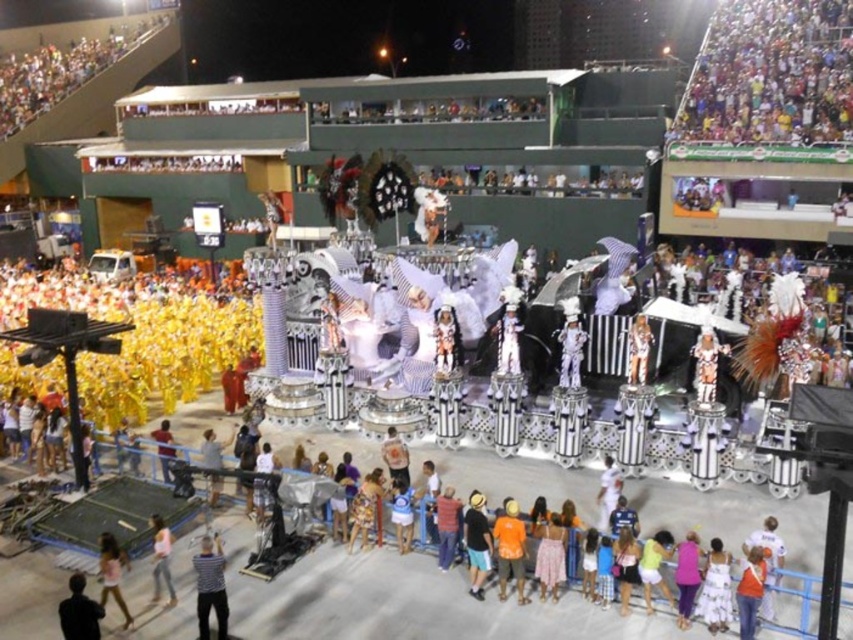
You are a photographer at the carnival parade. You want to take a photo of the orange cotton shirt at center and the black cotton shirt at center so that both shirts are fully visible. Which shirt should you focus on to ensure the shorter one is not cut off?

The orange cotton shirt at center is shorter than the black cotton shirt at center. To ensure the shorter one is not cut off, focus on framing the photo around the black cotton shirt at center since it is taller and requires more vertical space.

You are a photographer standing at the center of the carnival parade. You want to take a photo of the black matte person at lower left and the performers in bright yellow costumes on the left side of the float. How far apart are these two groups?

The black matte person at lower left and the performers in bright yellow costumes on the left side of the float are 84.85 feet apart.

You are a photographer at the carnival parade. You want to take a photo of the orange fabric person at center without the black matte person at lower left blocking the view. Is this possible?

The black matte person at lower left is in front of the orange fabric person at center, so the photographer cannot take a photo of the orange fabric person at center without the black matte person at lower left blocking the view.